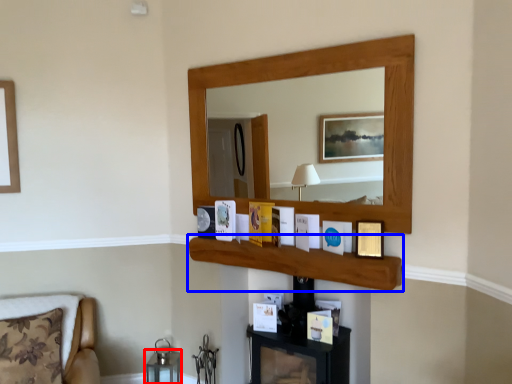
Question: Among these objects, which one is nearest to the camera, table (highlighted by a red box) or cabinet (highlighted by a blue box)?

Choices:
 (A) table
 (B) cabinet

Answer: (B)